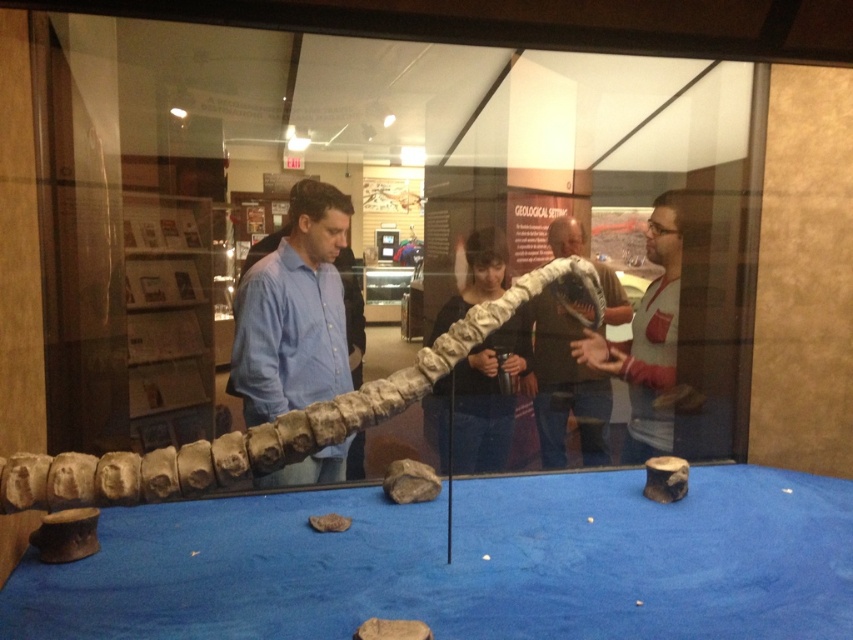
You are a museum visitor standing in front of the glass case displaying the fossilized snake skeleton. You notice two bones labeled as matte white dinosaur bone at center and matte gray dinosaur bone at center. Which bone is taller?

The matte white dinosaur bone at center is much taller than the matte gray dinosaur bone at center.

You are a visitor at the museum and want to take a photo of both the matte white dinosaur bone at center and the matte gray dinosaur bone at center. Since you want them both in the frame, which bone should you position closer to the camera to ensure both are visible?

You should position the matte white dinosaur bone at center closer to the camera because it is to the left of the matte gray dinosaur bone at center, so adjusting its position can help frame both in the photo.

You are a visitor at the museum and see the matte blue shirt at center and the matte gray dinosaur bone at center. Which object is positioned to the left when viewed from the front?

The matte blue shirt at center is positioned to the left of the matte gray dinosaur bone at center when viewed from the front.